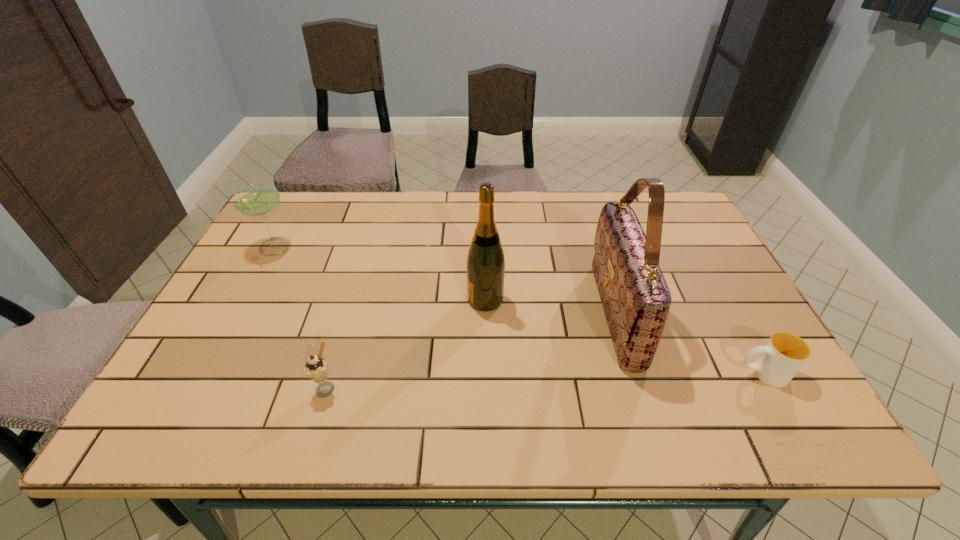
This screenshot has width=960, height=540. Identify the location of blank space located 0.310m on the front of the handbag with the clasp. (471, 313).

Where is `vacant space located on the front-facing side of the wine bottle`? The width and height of the screenshot is (960, 540). vacant space located on the front-facing side of the wine bottle is located at coordinates (354, 300).

The width and height of the screenshot is (960, 540). What are the coordinates of `vacant position located on the front-facing side of the wine bottle` in the screenshot? It's located at (350, 300).

The height and width of the screenshot is (540, 960). What are the coordinates of `free space located 0.300m on the front-facing side of the wine bottle` in the screenshot? It's located at (350, 300).

Find the location of a particular element. The height and width of the screenshot is (540, 960). vacant area situated 0.200m on the back of the third tallest object is located at coordinates (300, 198).

The image size is (960, 540). In order to click on vacant region located 0.380m on the back of the fourth object from right to left in this screenshot , I will do `click(364, 260)`.

At what (x,y) coordinates should I click in order to perform the action: click on vacant space situated with the handle on the side of the cup. Please return your answer as a coordinate pair (x, y). Image resolution: width=960 pixels, height=540 pixels. Looking at the image, I should click on (694, 373).

I want to click on free spot located 0.280m with the handle on the side of the cup, so click(x=608, y=373).

The height and width of the screenshot is (540, 960). Identify the location of vacant space located with the handle on the side of the cup. (571, 373).

The height and width of the screenshot is (540, 960). What are the coordinates of `object at the far edge` in the screenshot? It's located at [260, 199].